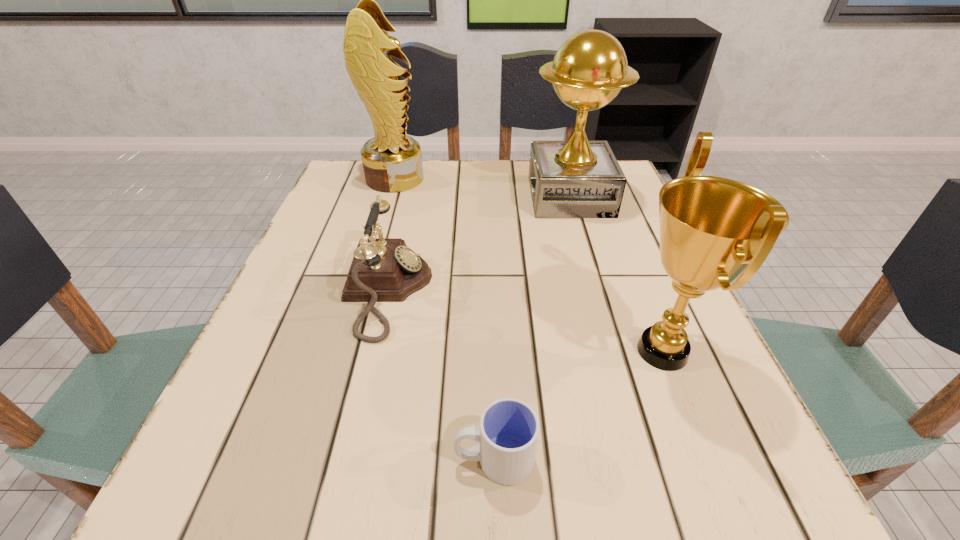
Find the location of `object that is the fourth closest to the leftmost award`. object that is the fourth closest to the leftmost award is located at coordinates (508, 433).

Locate which object is the fourth closest to the third object from right to left. Please provide its 2D coordinates. Your answer should be formatted as a tuple, i.e. [(x, y)], where the tuple contains the x and y coordinates of a point satisfying the conditions above.

[(392, 161)]

You are a GUI agent. You are given a task and a screenshot of the screen. Output one action in this format:
    pyautogui.click(x=<x>, y=<y>)
    Task: Click on the award that stands as the second closest to the leftmost award
    Image resolution: width=960 pixels, height=540 pixels.
    Given the screenshot: What is the action you would take?
    pyautogui.click(x=712, y=229)

Choose which award is the third nearest neighbor to the second shortest object. Please provide its 2D coordinates. Your answer should be formatted as a tuple, i.e. [(x, y)], where the tuple contains the x and y coordinates of a point satisfying the conditions above.

[(712, 229)]